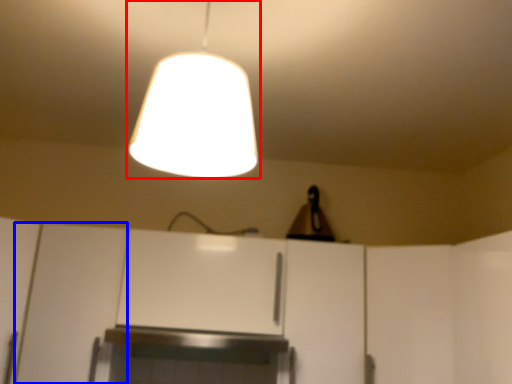
Question: Which object appears farthest to the camera in this image, lamp (highlighted by a red box) or cabinetry (highlighted by a blue box)?

Choices:
 (A) lamp
 (B) cabinetry

Answer: (B)